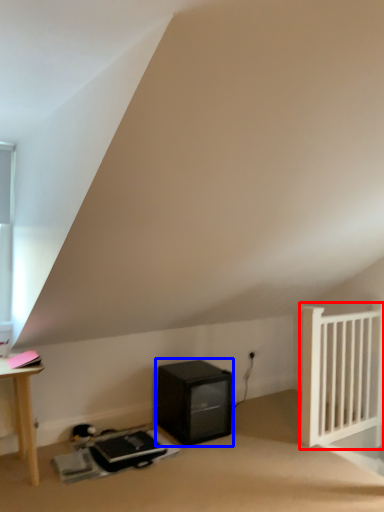
Question: Which object is closer to the camera taking this photo, radiator (highlighted by a red box) or appliance (highlighted by a blue box)?

Choices:
 (A) radiator
 (B) appliance

Answer: (B)